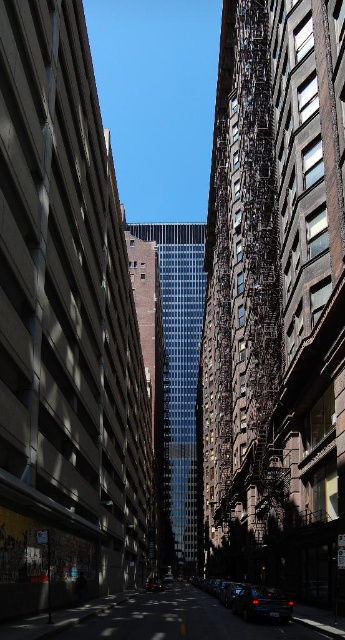
You are a pedestrian standing at the entrance of the street. You see a shiny black car at lower center and a shiny black sedan at center. Which vehicle is closer to you?

The shiny black car at lower center is closer to you because it is in front of the shiny black sedan at center.